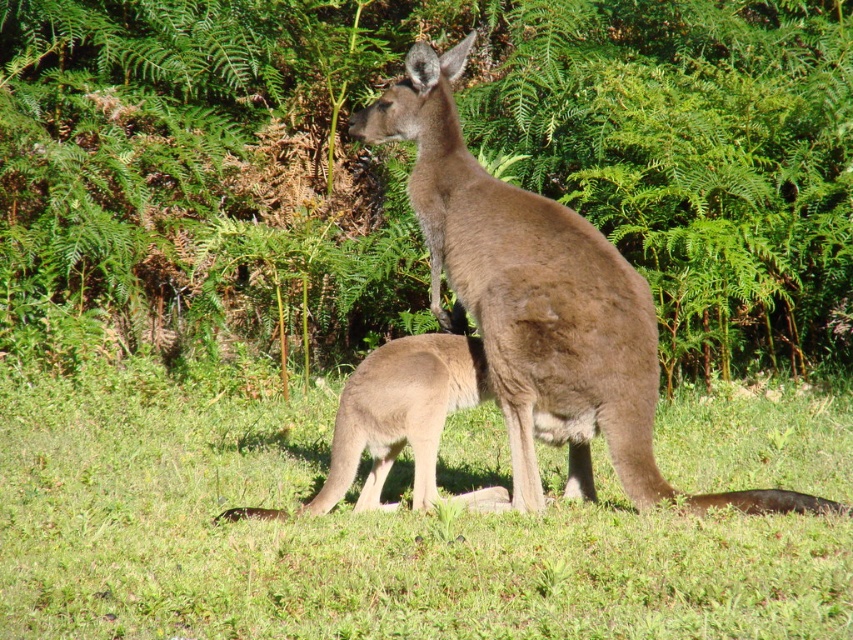
Question: Which point appears farthest from the camera in this image?

Choices:
 (A) (152, 76)
 (B) (654, 426)
 (C) (692, 496)

Answer: (A)

Question: Which point is farther to the camera?

Choices:
 (A) green grassy at center
 (B) brown furry kangaroo at center
 (C) green leafy foliage at center

Answer: (C)

Question: Estimate the real-world distances between objects in this image. Which object is closer to the green leafy foliage at center?

Choices:
 (A) green grassy at center
 (B) brown furry kangaroo at center

Answer: (B)

Question: Does green leafy foliage at center appear on the right side of green grassy at center?

Choices:
 (A) yes
 (B) no

Answer: (A)

Question: Does green leafy foliage at center have a larger size compared to green grassy at center?

Choices:
 (A) yes
 (B) no

Answer: (A)

Question: In this image, where is green leafy foliage at center located relative to brown furry kangaroo at center?

Choices:
 (A) left
 (B) right

Answer: (B)